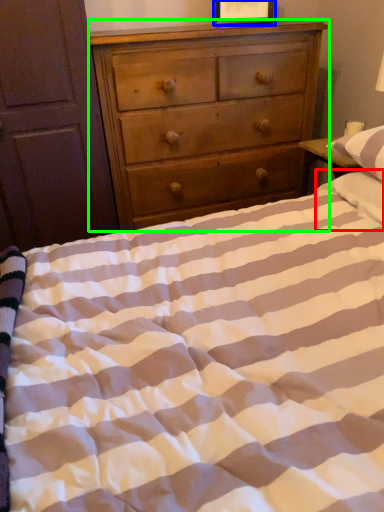
Question: Based on their relative distances, which object is nearer to pillow (highlighted by a red box)? Choose from picture frame (highlighted by a blue box) and chest of drawers (highlighted by a green box).

Choices:
 (A) picture frame
 (B) chest of drawers

Answer: (B)